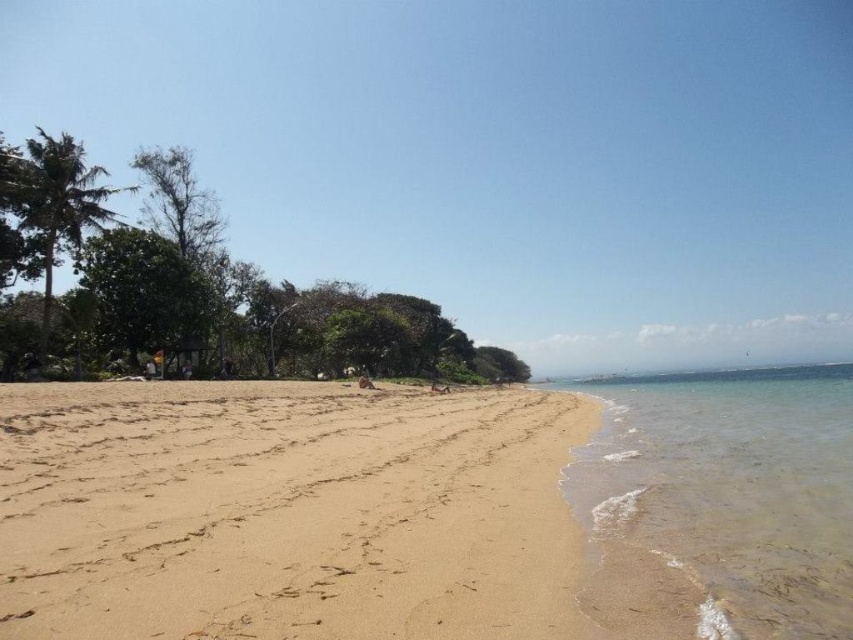
You are standing on the beach and want to walk to the clear water at lower right. Which direction should you move relative to the light brown sand at center?

You should move downward from the light brown sand at center to reach the clear water at lower right since the light brown sand at center is located above clear water at lower right.

You are planning to build a sandcastle on the beach. Given the light brown sand at center and the clear water at lower right, which area would be more suitable for building a stable sandcastle and why?

The light brown sand at center is more suitable for building a stable sandcastle because it occupies less space, allowing for better compaction and structure compared to the larger area of clear water at lower right which might be too wet or unstable.